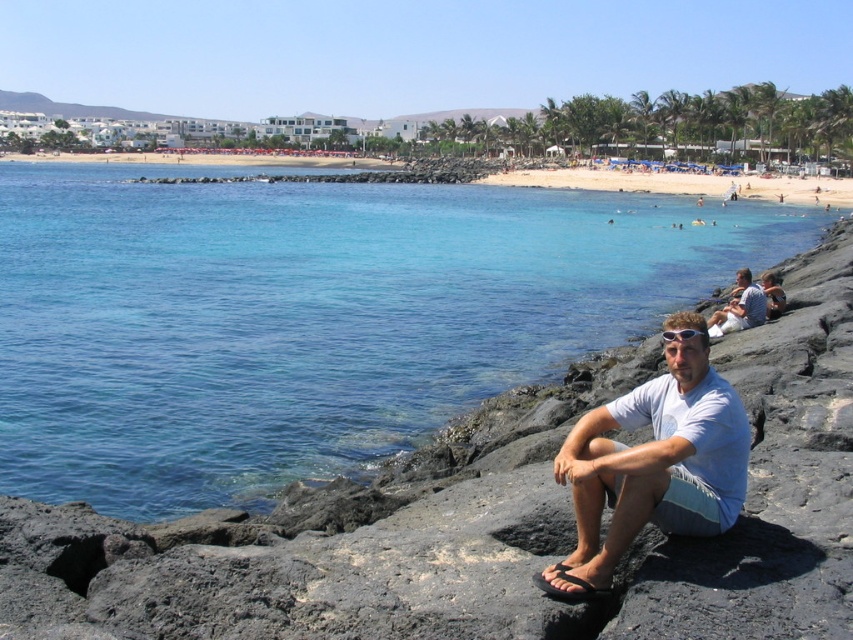
Question: Does white cotton shirt at center appear on the right side of white cotton shirt at lower right?

Choices:
 (A) yes
 (B) no

Answer: (B)

Question: Which point is farther to the camera?

Choices:
 (A) clear blue water at center
 (B) white cotton shirt at center

Answer: (A)

Question: Which object appears closest to the camera in this image?

Choices:
 (A) white cotton shirt at lower right
 (B) clear blue water at center

Answer: (B)

Question: Does clear blue water at center appear under white cotton shirt at center?

Choices:
 (A) no
 (B) yes

Answer: (A)

Question: Which object is positioned farthest from the white cotton shirt at center?

Choices:
 (A) white cotton shirt at lower right
 (B) clear blue water at center

Answer: (B)

Question: Does clear blue water at center appear on the right side of white cotton shirt at lower right?

Choices:
 (A) no
 (B) yes

Answer: (A)